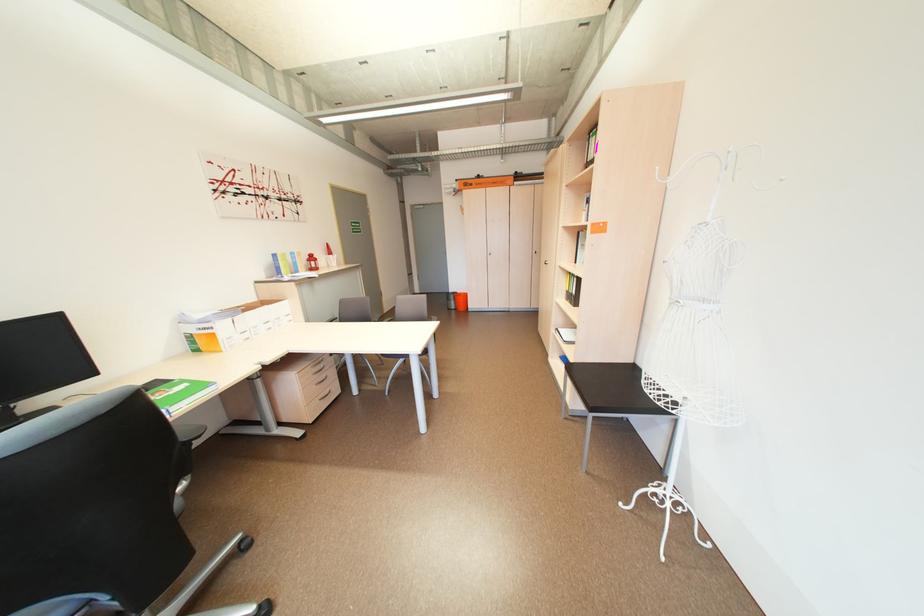
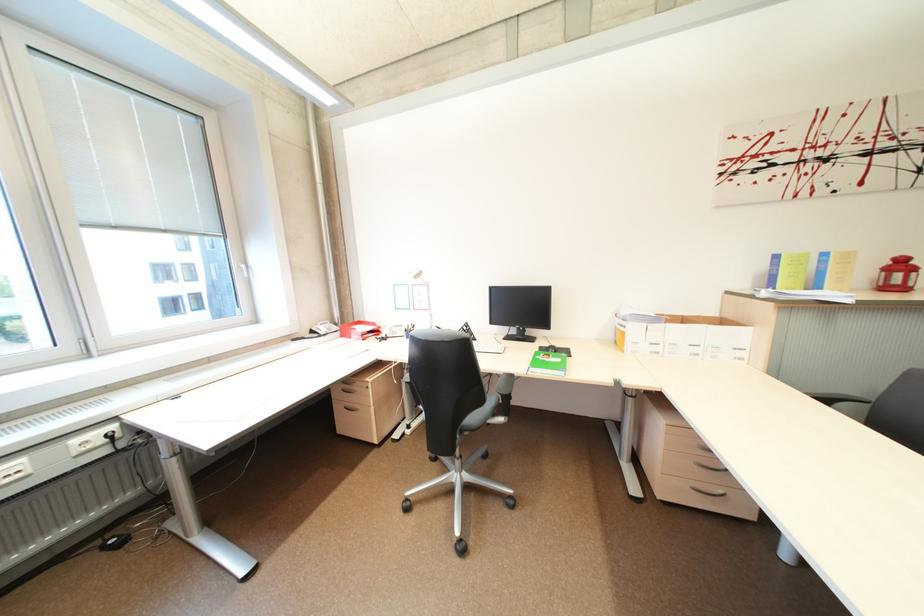
Find the pixel in the second image that matches pixel 223 334 in the first image.

(633, 334)